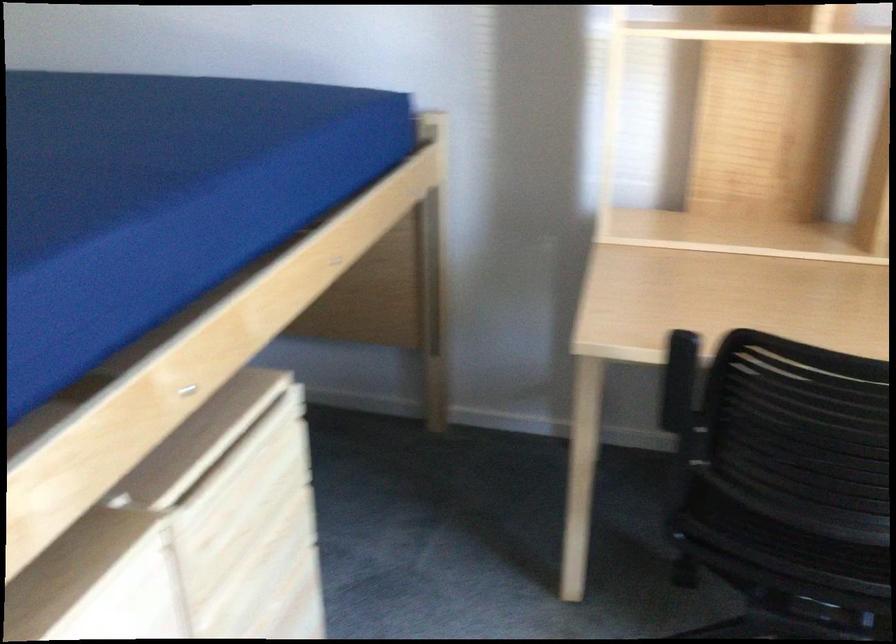
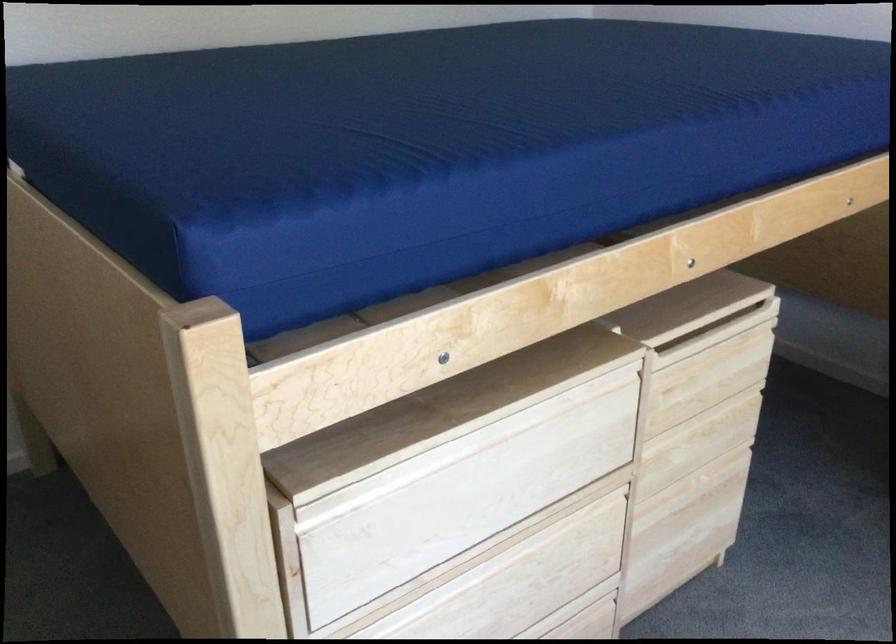
Question: The camera is either moving clockwise (left) or counter-clockwise (right) around the object. The first image is from the beginning of the video and the second image is from the end. Is the camera moving left or right when shooting the video?

Choices:
 (A) Left
 (B) Right

Answer: (B)